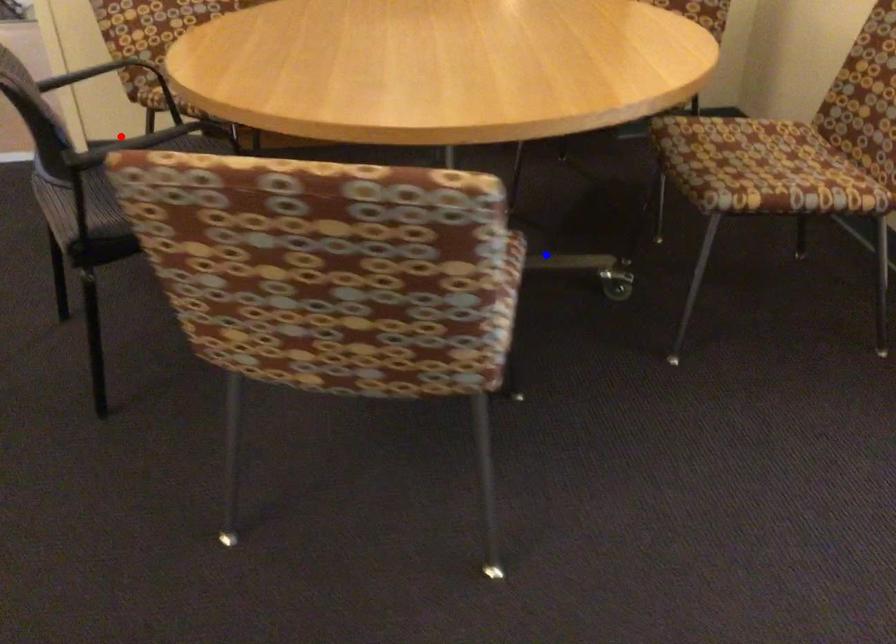
Question: In the image, two points are highlighted. Which point is nearer to the camera? Reply with the corresponding letter.

Choices:
 (A) blue point
 (B) red point

Answer: (B)